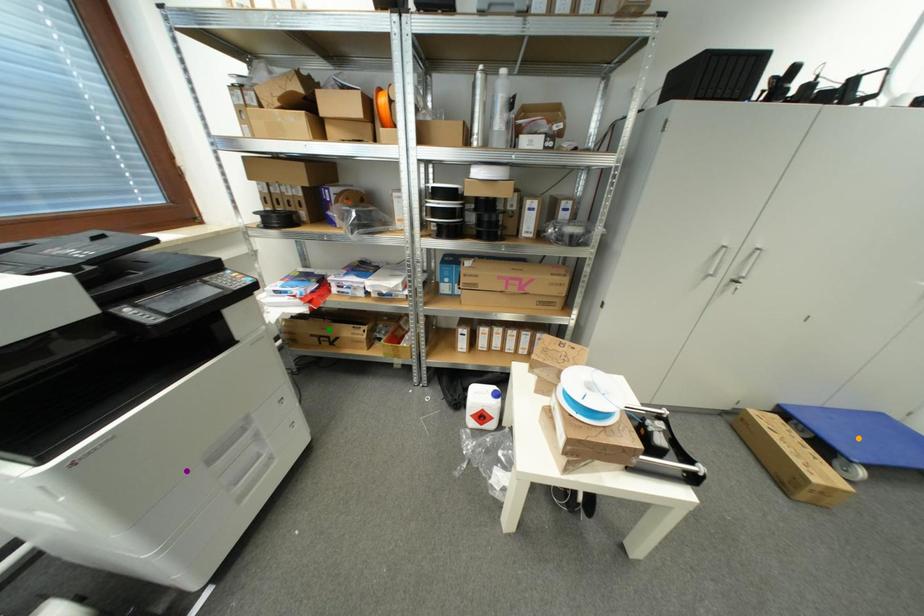
Order these from farthest to nearest:
orange point, purple point, green point

green point
orange point
purple point